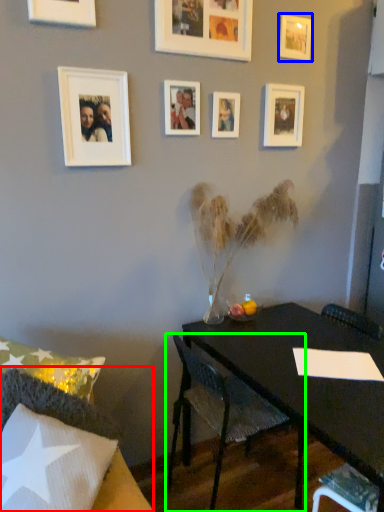
Question: Considering the real-world distances, which object is farthest from chair (highlighted by a red box)? picture frame (highlighted by a blue box) or chair (highlighted by a green box)?

Choices:
 (A) picture frame
 (B) chair

Answer: (A)